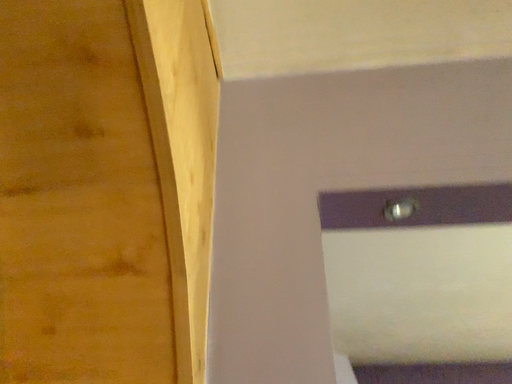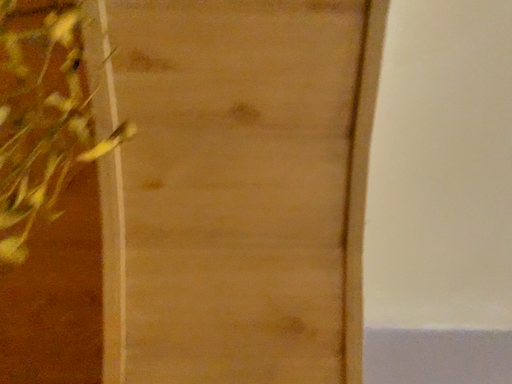
Question: How did the camera likely rotate when shooting the video?

Choices:
 (A) rotated downward
 (B) rotated upward

Answer: (B)